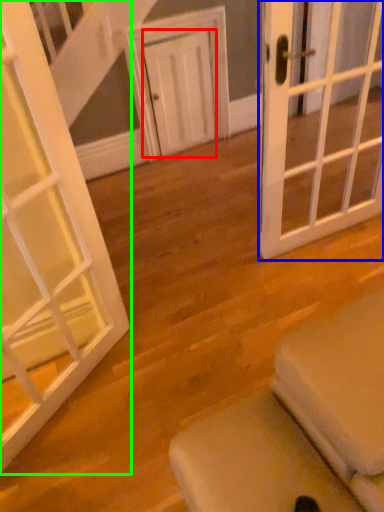
Question: Which object is positioned farthest from door (highlighted by a red box)? Select from door (highlighted by a blue box) and door (highlighted by a green box).

Choices:
 (A) door
 (B) door

Answer: (B)